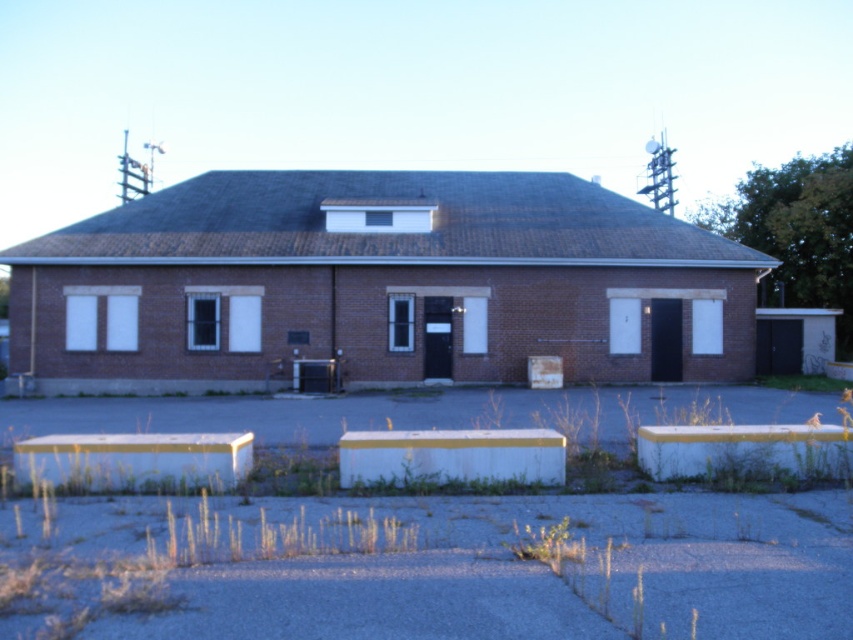
Between brown brick building at center and white concrete curb at lower right, which one appears on the right side from the viewer's perspective?

Positioned to the right is white concrete curb at lower right.

Describe the element at coordinates (378, 284) in the screenshot. I see `brown brick building at center` at that location.

This screenshot has width=853, height=640. Identify the location of brown brick building at center. (378, 284).